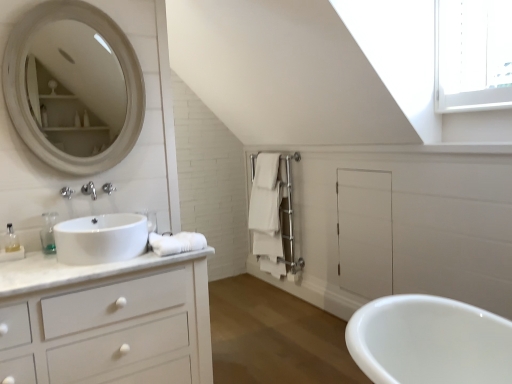
What do you see at coordinates (177, 243) in the screenshot? I see `white cotton bath towel at lower left, the 2th bath towel in the right-to-left sequence` at bounding box center [177, 243].

The height and width of the screenshot is (384, 512). Describe the element at coordinates (266, 208) in the screenshot. I see `white matte towel at center-right, placed as the first bath towel when sorted from right to left` at that location.

Describe the element at coordinates (101, 238) in the screenshot. This screenshot has height=384, width=512. I see `white glossy sink at left` at that location.

What is the approximate width of white matte cabinet at left?

21.26 inches.

Where is `silver metallic faucet at left`? Image resolution: width=512 pixels, height=384 pixels. silver metallic faucet at left is located at coordinates point(108,188).

Between white matte towel at center-right, which appears as the first bath towel when viewed from the top, and white matte mirror at upper left, which one has smaller size?

Smaller between the two is white matte mirror at upper left.

From a real-world perspective, which is physically above, white matte towel at center-right, which is the 2th bath towel in bottom-to-top order, or white matte mirror at upper left?

From a 3D spatial view, white matte mirror at upper left is above.

Is white matte towel at center-right, which appears as the first bath towel when viewed from the top, facing towards white matte mirror at upper left?

Yes, white matte towel at center-right, which appears as the first bath towel when viewed from the top, is oriented towards white matte mirror at upper left.

From the image's perspective, is white matte mirror at upper left located beneath white glossy sink at left?

Actually, white matte mirror at upper left appears above white glossy sink at left in the image.

Considering the positions of point (76, 90) and point (89, 227), is point (76, 90) closer or farther from the camera than point (89, 227)?

Point (76, 90) is positioned farther from the camera compared to point (89, 227).

From a real-world perspective, which object stands above the other?

white matte mirror at upper left.

Is white matte mirror at upper left wider than white glossy sink at left?

In fact, white matte mirror at upper left might be narrower than white glossy sink at left.

The width and height of the screenshot is (512, 384). Identify the location of sink below the silver metallic faucet at left (from a real-world perspective). pyautogui.click(x=101, y=238).

From a real-world perspective, who is located lower, white glossy sink at left or silver metallic faucet at left?

white glossy sink at left is physically lower.

Does white glossy sink at left touch silver metallic faucet at left?

They are not placed beside each other.

Based on their sizes in the image, would you say white glossy sink at left is bigger or smaller than silver metallic faucet at left?

Clearly, white glossy sink at left is larger in size than silver metallic faucet at left.

Is point (154, 230) positioned after point (56, 213)?

Yes, it is behind point (56, 213).

Considering the relative positions of white glossy soap dispenser at left, which appears as the third toiletry when viewed from the left, and translucent plastic bottle at left, which is the 2th toiletry from left to right, in the image provided, is white glossy soap dispenser at left, which appears as the third toiletry when viewed from the left, to the left of translucent plastic bottle at left, which is the 2th toiletry from left to right, from the viewer's perspective?

Incorrect, white glossy soap dispenser at left, which appears as the third toiletry when viewed from the left, is not on the left side of translucent plastic bottle at left, which is the 2th toiletry from left to right.

Who is shorter, white glossy soap dispenser at left, the 1th toiletry from the back, or translucent plastic bottle at left, the 2th toiletry in the front-to-back sequence?

Standing shorter between the two is white glossy soap dispenser at left, the 1th toiletry from the back.

In the scene shown: Is translucent plastic soap dispenser at left, the first toiletry positioned from the left, aimed at white glossy sink at left?

No.

Is white glossy sink at left inside translucent plastic soap dispenser at left, which is counted as the first toiletry, starting from the front?

No, white glossy sink at left is not surrounded by translucent plastic soap dispenser at left, which is counted as the first toiletry, starting from the front.

How far apart are translucent plastic soap dispenser at left, placed as the third toiletry when sorted from back to front, and white glossy sink at left?

The distance of translucent plastic soap dispenser at left, placed as the third toiletry when sorted from back to front, from white glossy sink at left is 50.58 centimeters.

From the image's perspective, which is above, translucent plastic soap dispenser at left, the first toiletry positioned from the left, or white glossy sink at left?

white glossy sink at left appears higher in the image.

The height and width of the screenshot is (384, 512). In order to click on toiletry that is the 1st one when counting forward from the silver metallic faucet at left in this screenshot , I will do `click(48, 232)`.

Between point (114, 189) and point (42, 218), which one is positioned in front?

The point (42, 218) is closer.

Is silver metallic faucet at left positioned behind translucent plastic bottle at left, which is the 2th toiletry from left to right?

Yes, the depth of silver metallic faucet at left is greater than that of translucent plastic bottle at left, which is the 2th toiletry from left to right.

Is silver metallic faucet at left not inside translucent plastic bottle at left, the 2th toiletry in the front-to-back sequence?

Yes, silver metallic faucet at left is outside of translucent plastic bottle at left, the 2th toiletry in the front-to-back sequence.

Does silver metallic faucet at left contain white matte mirror at upper left?

No, silver metallic faucet at left does not contain white matte mirror at upper left.

Can you confirm if silver metallic faucet at left is thinner than white matte mirror at upper left?

In fact, silver metallic faucet at left might be wider than white matte mirror at upper left.

Is silver metallic faucet at left aimed at white matte mirror at upper left?

No, silver metallic faucet at left is not turned towards white matte mirror at upper left.

How different are the orientations of silver metallic faucet at left and white matte mirror at upper left in degrees?

The angular difference between silver metallic faucet at left and white matte mirror at upper left is 0.308 degrees.

Locate an element on the screen. mirror lying above the white matte towel at center-right, which is counted as the 2th bath towel, starting from the front (from the image's perspective) is located at coordinates (75, 88).

The width and height of the screenshot is (512, 384). What are the coordinates of `sink that appears below the white matte mirror at upper left (from a real-world perspective)` in the screenshot? It's located at (101, 238).

Which object lies further to the anchor point white matte cabinet at left, white glossy soap dispenser at left, the 1th toiletry from the back, or silver metallic faucet at left?

silver metallic faucet at left is further to white matte cabinet at left.

Based on the photo, which object lies nearer to the anchor point translucent plastic bottle at left, the 2th toiletry when ordered from right to left, white matte cabinet at left or silver metallic faucet at left?

silver metallic faucet at left is positioned closer to the anchor translucent plastic bottle at left, the 2th toiletry when ordered from right to left.

Looking at the image, which one is located closer to translucent plastic soap dispenser at left, which is counted as the first toiletry, starting from the front, white glossy sink at left or translucent plastic bottle at left, which is the 2th toiletry from left to right?

translucent plastic bottle at left, which is the 2th toiletry from left to right.

Based on their spatial positions, is white cotton bath towel at lower left, the first bath towel positioned from the left, or white matte cabinet at left closer to translucent plastic soap dispenser at left, the first toiletry positioned from the left?

white matte cabinet at left.

Considering their positions, is white glossy soap dispenser at left, which appears as the third toiletry when viewed from the left, positioned closer to white matte cabinet at left than white glossy sink at left?

white glossy sink at left.

Considering their positions, is white glossy sink at left positioned closer to white cotton bath towel at lower left, the first bath towel positioned from the left, than white matte mirror at upper left?

white glossy sink at left lies closer to white cotton bath towel at lower left, the first bath towel positioned from the left, than the other object.

Considering their positions, is white cotton bath towel at lower left, the 2th bath towel in the right-to-left sequence, positioned closer to translucent plastic soap dispenser at left, which is counted as the first toiletry, starting from the front, than white glossy sink at left?

Based on the image, white glossy sink at left appears to be nearer to translucent plastic soap dispenser at left, which is counted as the first toiletry, starting from the front.

In the scene shown: Considering their positions, is white glossy sink at left positioned further to translucent plastic bottle at left, the 2th toiletry in the back-to-front sequence, than white glossy soap dispenser at left, the 1th toiletry from the back?

The object further to translucent plastic bottle at left, the 2th toiletry in the back-to-front sequence, is white glossy soap dispenser at left, the 1th toiletry from the back.

Where is `faucet located between white matte mirror at upper left and white matte towel at center-right, which appears as the first bath towel when viewed from the top, in the depth direction`? faucet located between white matte mirror at upper left and white matte towel at center-right, which appears as the first bath towel when viewed from the top, in the depth direction is located at coordinates (108, 188).

Identify the location of sink between white matte mirror at upper left and white cotton bath towel at lower left, which is counted as the 2th bath towel, starting from the back, in the up-down direction. (101, 238).

This screenshot has height=384, width=512. Find the location of `faucet between white cotton bath towel at lower left, the second bath towel viewed from the top, and white matte towel at center-right, which is the 2th bath towel in bottom-to-top order, along the z-axis`. faucet between white cotton bath towel at lower left, the second bath towel viewed from the top, and white matte towel at center-right, which is the 2th bath towel in bottom-to-top order, along the z-axis is located at coordinates (108, 188).

Image resolution: width=512 pixels, height=384 pixels. Identify the location of bath towel between white matte cabinet at left and white glossy soap dispenser at left, arranged as the 3th toiletry when viewed from the front, in the front-back direction. (177, 243).